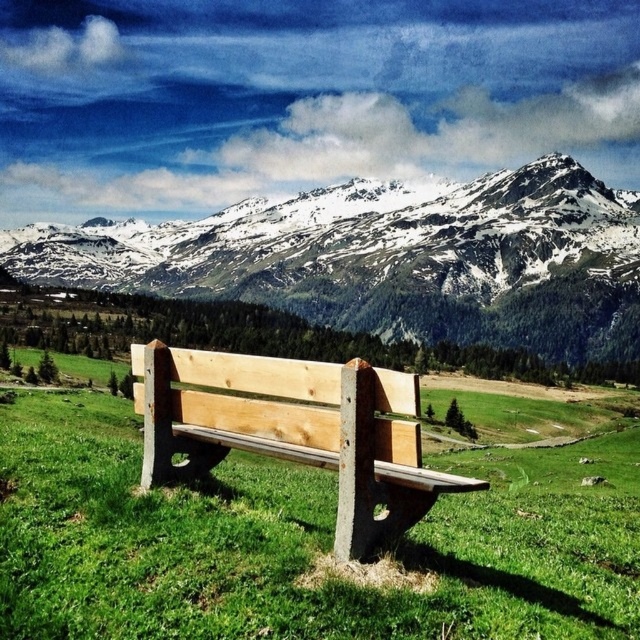
Question: Can you confirm if natural green grass at center is thinner than natural wood bench at center?

Choices:
 (A) yes
 (B) no

Answer: (B)

Question: Estimate the real-world distances between objects in this image. Which object is farther from the natural green grass at center?

Choices:
 (A) natural wood bench at center
 (B) snowy granite mountain range at upper center

Answer: (B)

Question: Can you confirm if natural green grass at center is positioned above snowy granite mountain range at upper center?

Choices:
 (A) yes
 (B) no

Answer: (B)

Question: Considering the real-world distances, which object is closest to the natural green grass at center?

Choices:
 (A) natural wood bench at center
 (B) snowy granite mountain range at upper center

Answer: (A)

Question: Which point is farther to the camera?

Choices:
 (A) (273, 436)
 (B) (269, 588)

Answer: (A)

Question: Does snowy granite mountain range at upper center have a greater width compared to natural wood bench at center?

Choices:
 (A) no
 (B) yes

Answer: (B)